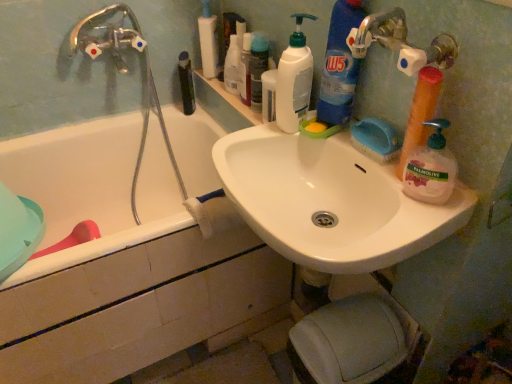
Where is `free point in front of translucent orange sponge at right, placed as the second cleaning product when sorted from right to left`? free point in front of translucent orange sponge at right, placed as the second cleaning product when sorted from right to left is located at coordinates (412, 216).